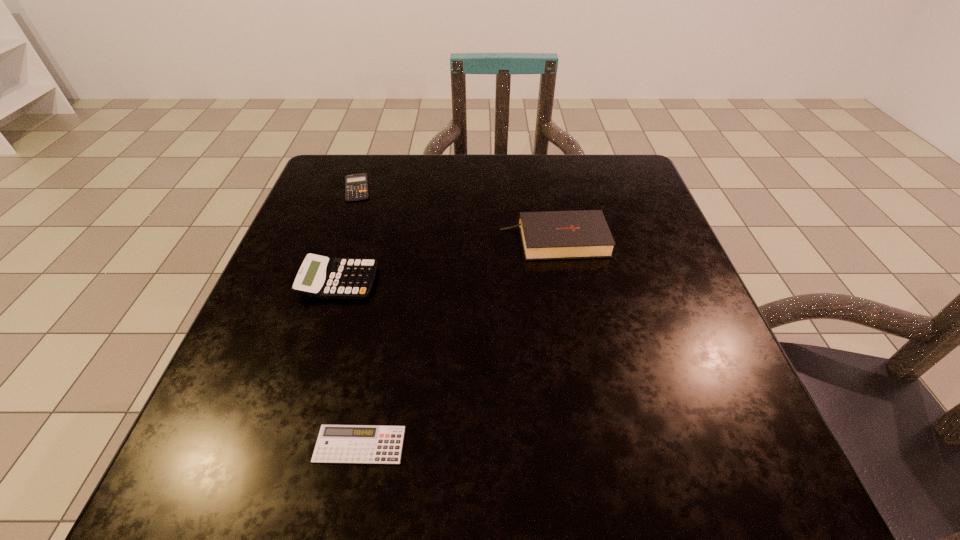
The height and width of the screenshot is (540, 960). I want to click on Bible, so click(550, 235).

Where is `the tallest object`? The width and height of the screenshot is (960, 540). the tallest object is located at coordinates (550, 235).

Where is `the second nearest calculator`? Image resolution: width=960 pixels, height=540 pixels. the second nearest calculator is located at coordinates (319, 276).

Identify the location of the tallest calculator. (319, 276).

At what (x,y) coordinates should I click in order to perform the action: click on the second tallest calculator. Please return your answer as a coordinate pair (x, y). Image resolution: width=960 pixels, height=540 pixels. Looking at the image, I should click on (356, 185).

The height and width of the screenshot is (540, 960). In order to click on the farthest calculator in this screenshot , I will do `click(356, 185)`.

I want to click on the nearest calculator, so click(x=336, y=443).

You are a GUI agent. You are given a task and a screenshot of the screen. Output one action in this format:
    pyautogui.click(x=<x>, y=<y>)
    Task: Click on the shortest object
    Image resolution: width=960 pixels, height=540 pixels.
    Given the screenshot: What is the action you would take?
    pyautogui.click(x=336, y=443)

This screenshot has width=960, height=540. Identify the location of free region located 0.080m on the back of the third nearest object. (546, 201).

At what (x,y) coordinates should I click in order to perform the action: click on free location located on the right of the tallest calculator. Please return your answer as a coordinate pair (x, y). Looking at the image, I should click on (541, 282).